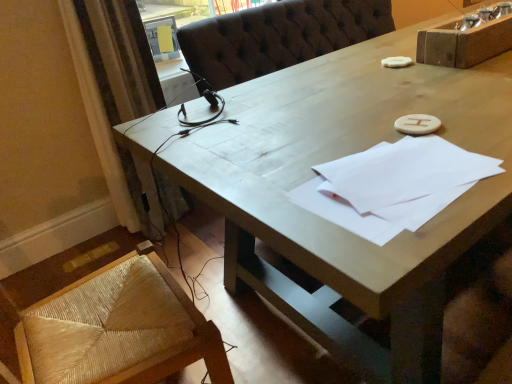
This screenshot has width=512, height=384. I want to click on free point below white paper at center (from a real-world perspective), so click(397, 186).